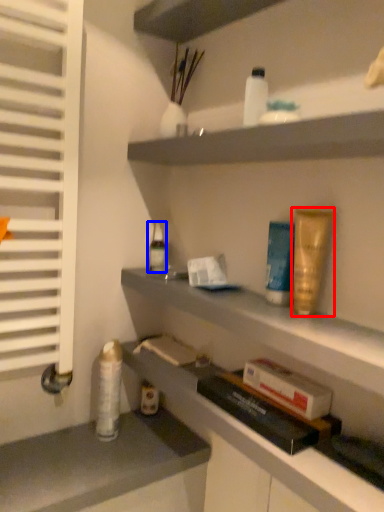
Question: Which point is further to the camera, toiletry (highlighted by a red box) or toiletry (highlighted by a blue box)?

Choices:
 (A) toiletry
 (B) toiletry

Answer: (B)